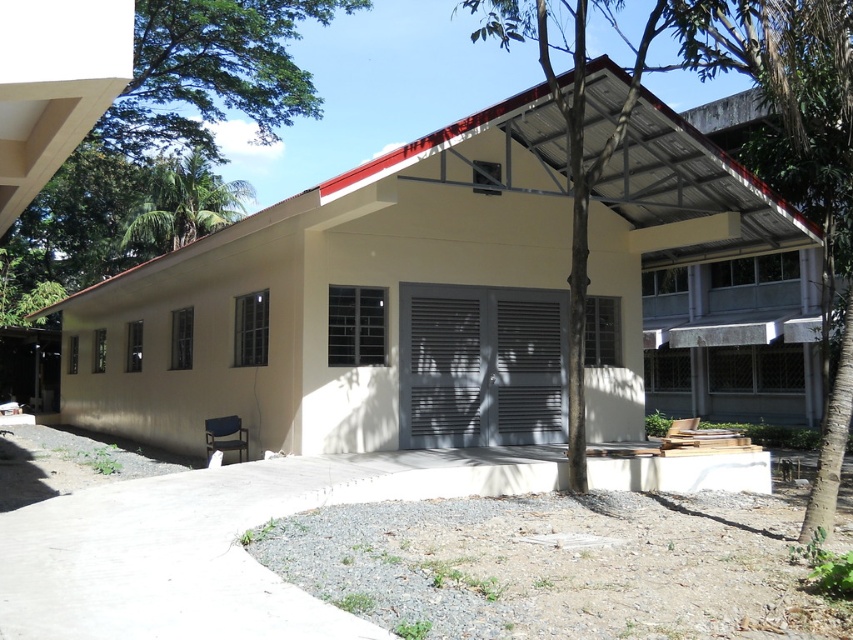
You are a gardener planning to plant a new tree in front of the building. The existing trees are the green leafy tree at center and the green leafy tree at upper left. Which tree has a wider canopy? Please base your answer on the scene description provided.

The green leafy tree at center has a wider canopy than the green leafy tree at upper left.

You are standing at the entrance of the building and looking towards the green leafy tree at center and the green leafy tree at upper left. Which tree appears taller from your current position?

The green leafy tree at center appears taller than the green leafy tree at upper left because it has a greater height compared to the latter.